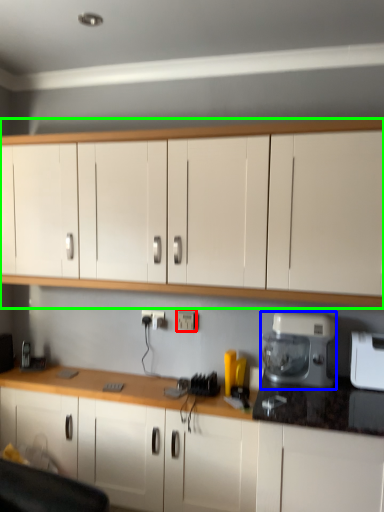
Question: Considering the real-world distances, which object is farthest from electric outlet (highlighted by a red box)? home appliance (highlighted by a blue box) or cabinetry (highlighted by a green box)?

Choices:
 (A) home appliance
 (B) cabinetry

Answer: (B)